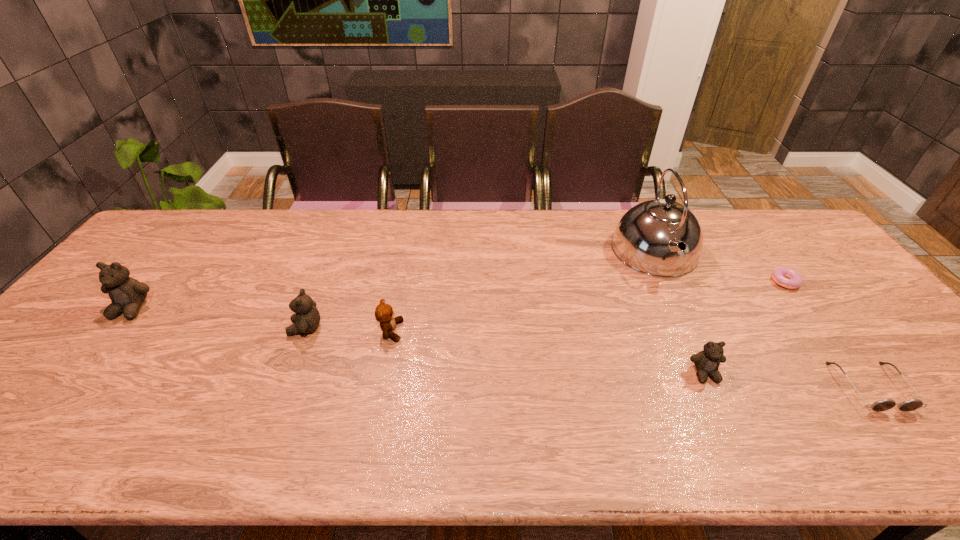
If equal spacing is the goal by inserting an additional teddy_bear among them, please point out a vacant space for this new teddy_bear. Please provide its 2D coordinates. Your answer should be formatted as a tuple, i.e. [(x, y)], where the tuple contains the x and y coordinates of a point satisfying the conditions above.

[(495, 350)]